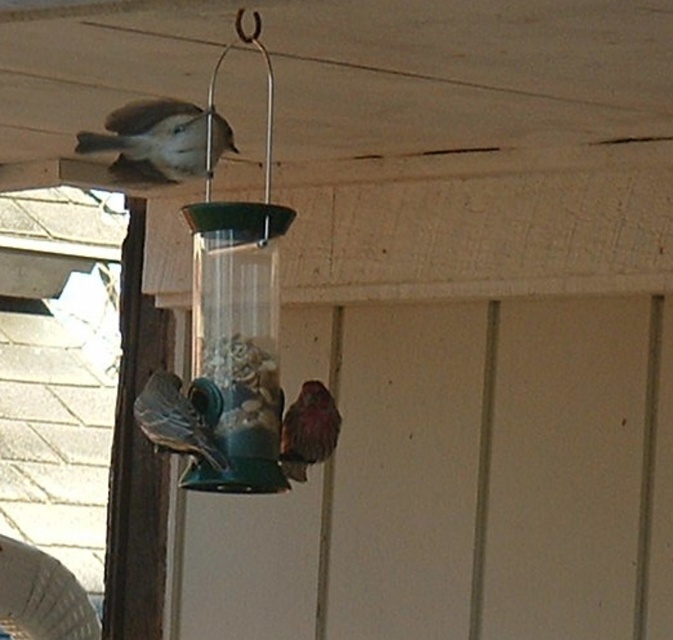
Can you confirm if blue-green metallic bird feeder at lower left is positioned above brown speckled sparrow at center?

Yes.

Does point (184, 397) come farther from viewer compared to point (332, 416)?

No, it is in front of (332, 416).

In order to click on blue-green metallic bird feeder at lower left in this screenshot , I will do `click(174, 420)`.

Can you confirm if brown speckled bird at upper left is shorter than blue-green metallic bird feeder at lower left?

Yes, brown speckled bird at upper left is shorter than blue-green metallic bird feeder at lower left.

Is point (141, 122) in front of point (227, 465)?

That is False.

Where is `brown speckled bird at upper left`? brown speckled bird at upper left is located at coordinates coord(151,140).

Between brown speckled bird at upper left and brown speckled sparrow at center, which one has less height?

Answer: With less height is brown speckled bird at upper left.

Between point (155, 179) and point (306, 400), which one is positioned in front?

Positioned in front is point (155, 179).

Locate an element on the screen. The width and height of the screenshot is (673, 640). brown speckled bird at upper left is located at coordinates (151, 140).